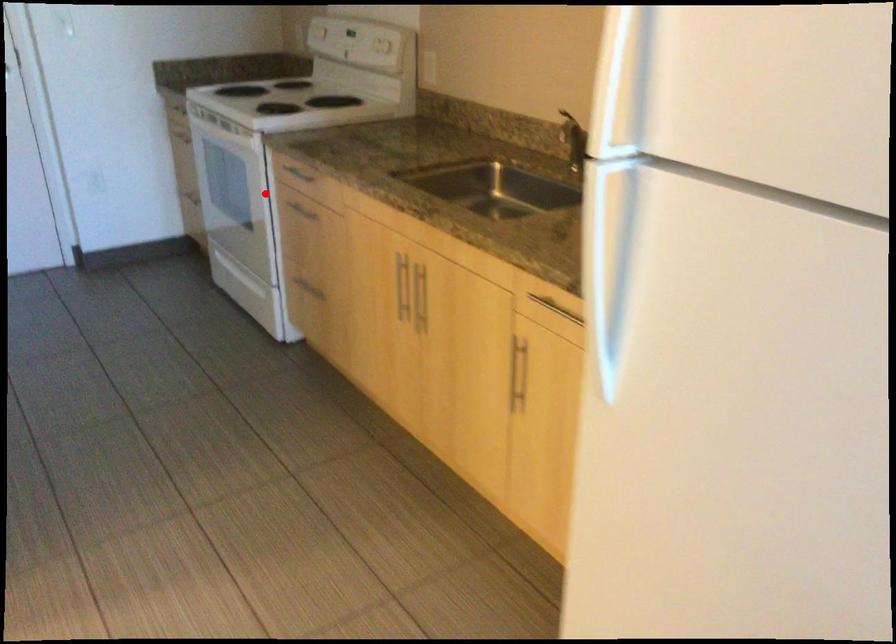
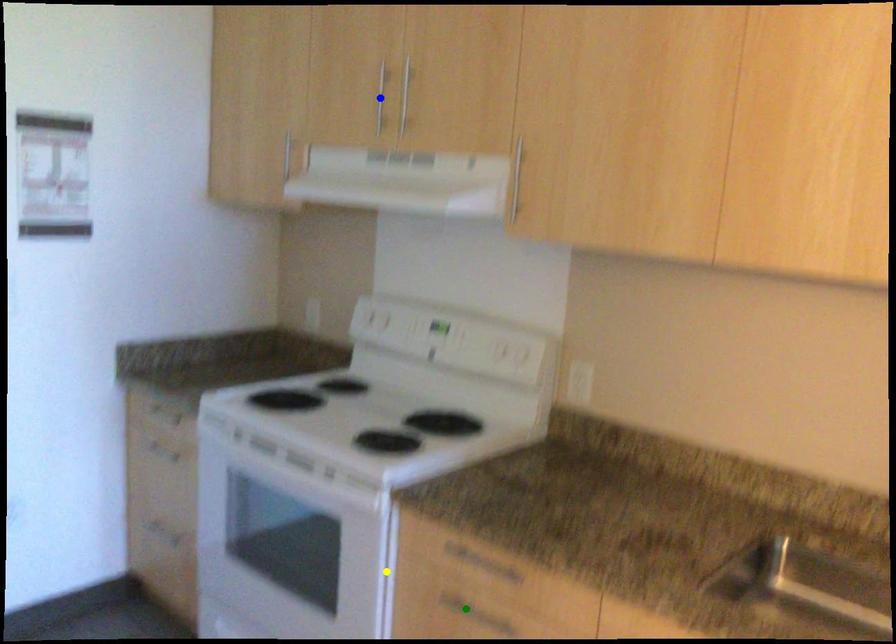
Question: I am providing you with two images of the same scene from different viewpoints. A red point is marked on the first image. You are given multiple points on the second image. Which spot in image 2 lines up with the point in image 1?

Choices:
 (A) yellow point
 (B) blue point
 (C) green point

Answer: (A)